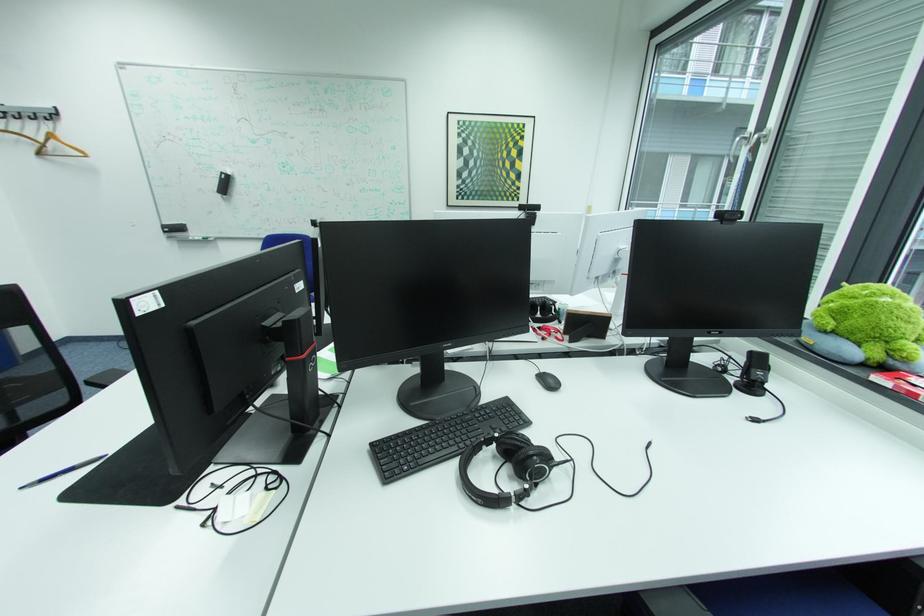
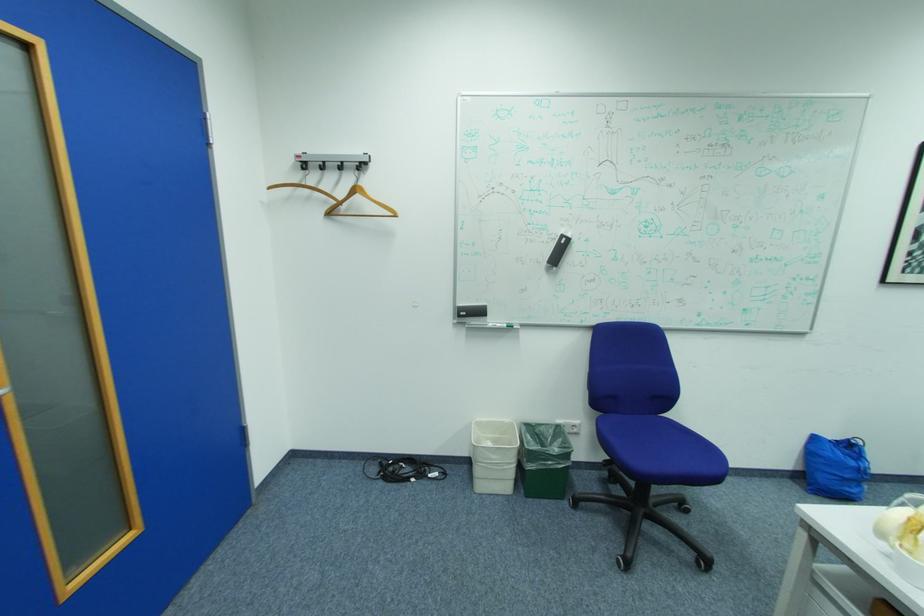
The point at (175, 223) is marked in the first image. Where is the corresponding point in the second image?

(469, 305)